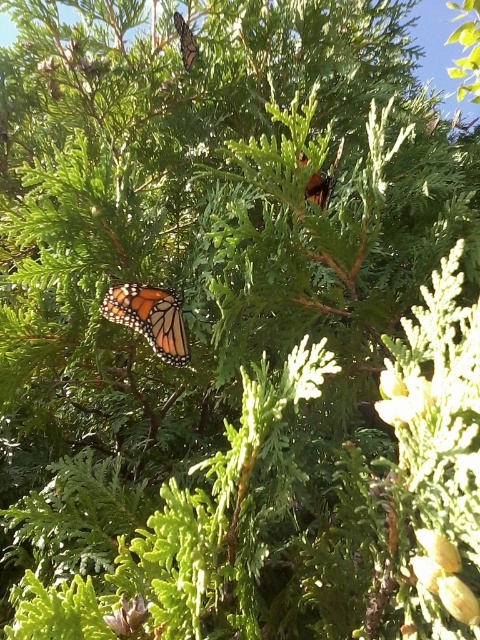
You are a nature photographer trying to capture a closeup of the orange and black spotted butterfly at center and the orange and black spotted butterfly at upper center. Which butterfly should you focus on to ensure it fills more of your camera frame?

The orange and black spotted butterfly at center is wider than the orange and black spotted butterfly at upper center, so focusing on the one at center will fill the frame more.